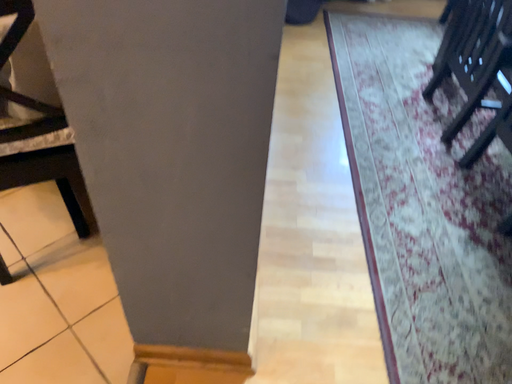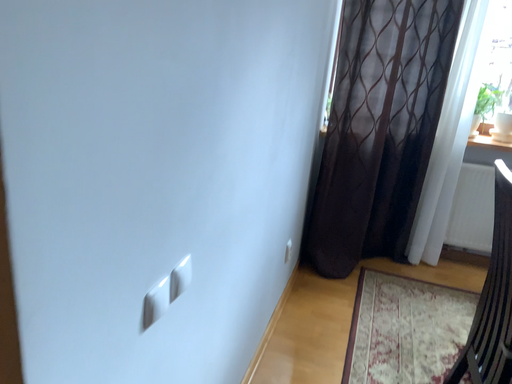
Question: How did the camera likely rotate when shooting the video?

Choices:
 (A) rotated upward
 (B) rotated downward

Answer: (A)